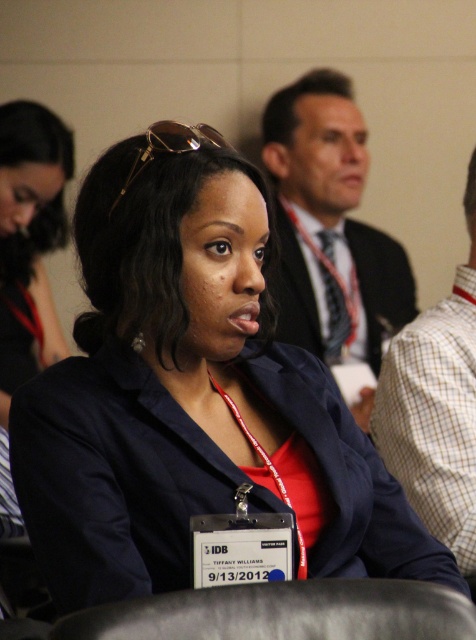
Question: Is dark suit jacket at upper center in front of white checkered shirt at right?

Choices:
 (A) yes
 (B) no

Answer: (B)

Question: In this image, where is dark gray leather chair at lower center located relative to matte black jacket at center?

Choices:
 (A) below
 (B) above

Answer: (A)

Question: Considering the real-world distances, which object is closest to the dark suit jacket at upper center?

Choices:
 (A) matte black jacket at center
 (B) white checkered shirt at right
 (C) dark gray leather chair at lower center

Answer: (A)

Question: Which point is closer to the camera?

Choices:
 (A) (9, 372)
 (B) (139, 602)
 (C) (452, 472)
 (D) (387, 310)

Answer: (B)

Question: Which of the following is the closest to the observer?

Choices:
 (A) (306, 131)
 (B) (472, 323)
 (C) (49, 148)

Answer: (B)

Question: Observing the image, what is the correct spatial positioning of dark gray leather chair at lower center in reference to matte black jacket at center?

Choices:
 (A) below
 (B) above

Answer: (A)